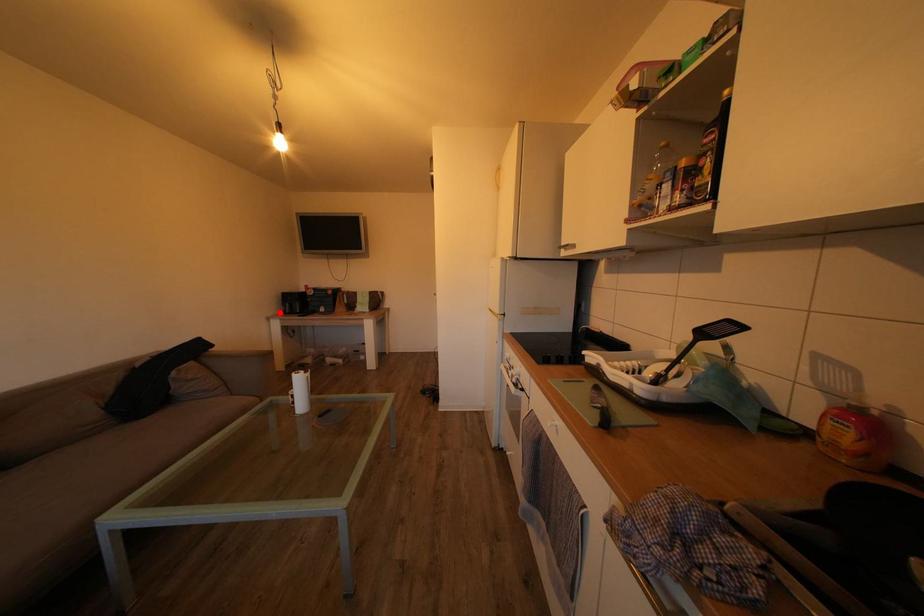
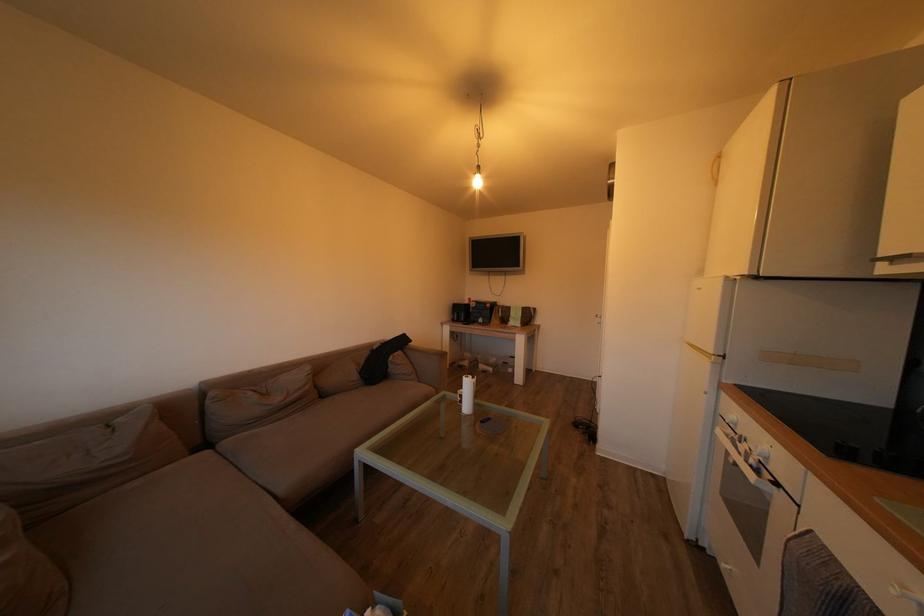
The point at the highlighted location is marked in the first image. Where is the corresponding point in the second image?

(453, 320)